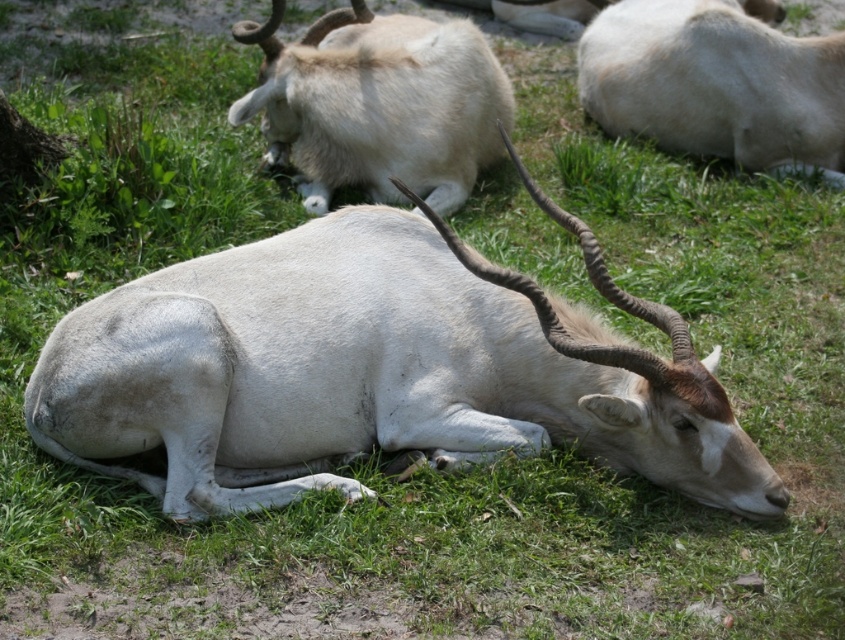
You are a photographer trying to capture the white antelope lying down in the foreground. You notice two points in the image labeled as point 1 at coordinates point (120, 305) and point 2 at coordinates point (429, 163). Which point is closer to your camera lens?

Point (120, 305) is closer to the camera lens than point (429, 163).

You are a wildlife photographer aiming to capture a photo of the white matte antelope at center and the white woolly antelope at upper right. Based on their positions, which antelope would appear closer to the camera in the photo?

The white matte antelope at center is located below the white woolly antelope at upper right, so the white woolly antelope at upper right would appear closer to the camera in the photo.

You are an animal researcher observing the white antelopes in the image. You notice two points marked in the scene. Which point is closer to you, point at coordinate (123, 324) or point at coordinate (650, 84)?

Point at coordinate (123, 324) is closer to you than point at coordinate (650, 84).